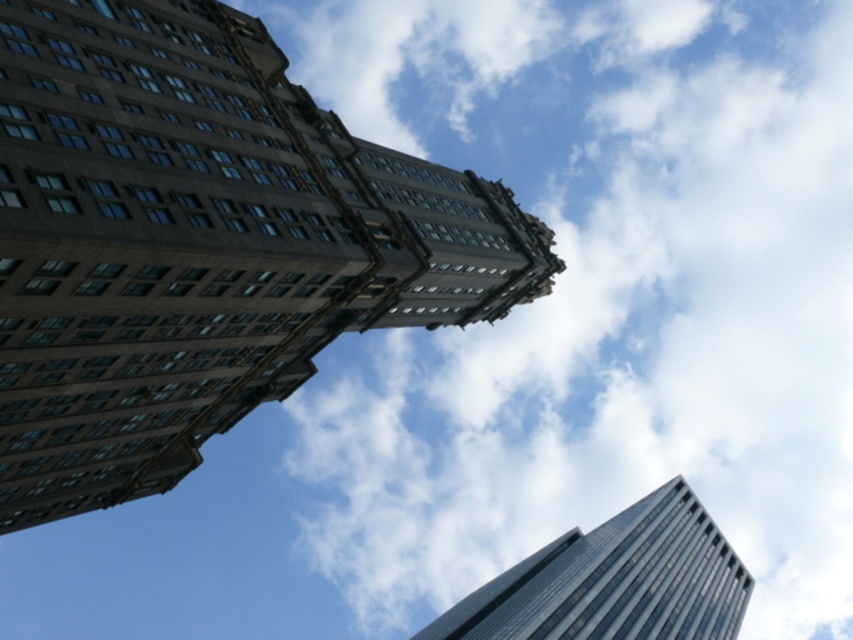
Question: Which of the following is the closest to the observer?

Choices:
 (A) white fluffy cloud at upper center
 (B) glassy reflective skyscraper at lower right
 (C) brown stone tower at upper left

Answer: (C)

Question: Which object appears farthest from the camera in this image?

Choices:
 (A) glassy reflective skyscraper at lower right
 (B) white fluffy cloud at upper center
 (C) brown stone tower at upper left

Answer: (A)

Question: Observing the image, what is the correct spatial positioning of brown stone tower at upper left in reference to glassy reflective skyscraper at lower right?

Choices:
 (A) above
 (B) below

Answer: (A)

Question: Is white fluffy cloud at upper center closer to the viewer compared to glassy reflective skyscraper at lower right?

Choices:
 (A) yes
 (B) no

Answer: (A)

Question: Considering the relative positions of white fluffy cloud at upper center and brown stone tower at upper left in the image provided, where is white fluffy cloud at upper center located with respect to brown stone tower at upper left?

Choices:
 (A) right
 (B) left

Answer: (A)

Question: Which point is closer to the camera?

Choices:
 (A) white fluffy cloud at upper center
 (B) brown stone tower at upper left

Answer: (B)